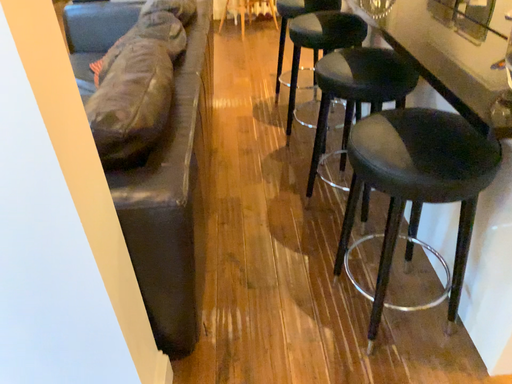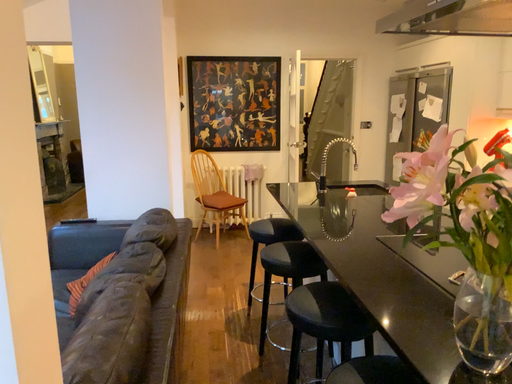
Question: How did the camera likely rotate when shooting the video?

Choices:
 (A) rotated upward
 (B) rotated downward

Answer: (A)